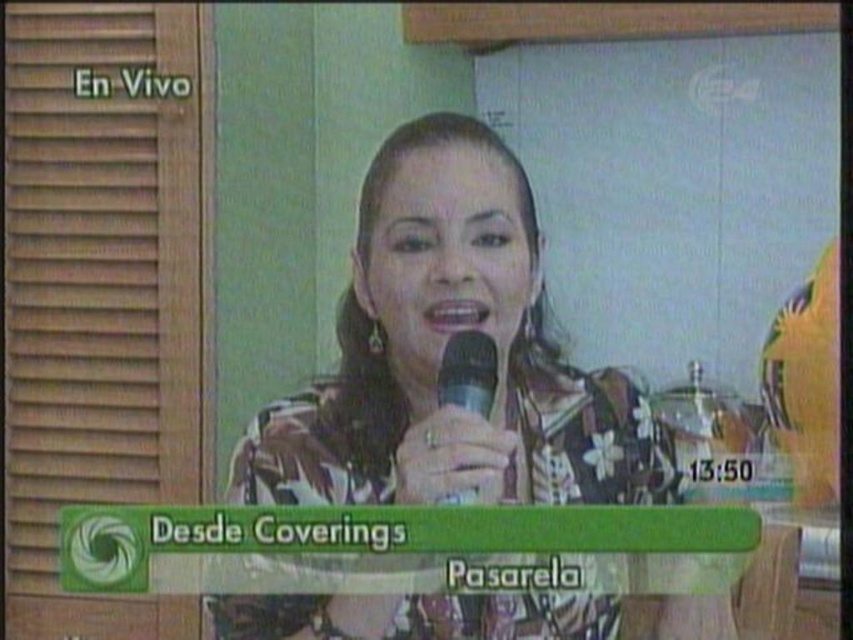
Which is above, floral-patterned blouse at center or matte black microphone at center?

matte black microphone at center is above.

Can you confirm if floral-patterned blouse at center is positioned below matte black microphone at center?

Indeed, floral-patterned blouse at center is positioned under matte black microphone at center.

Who is more forward, (351, 497) or (450, 339)?

Point (351, 497) is in front.

Where is `floral-patterned blouse at center`? This screenshot has width=853, height=640. floral-patterned blouse at center is located at coordinates (440, 353).